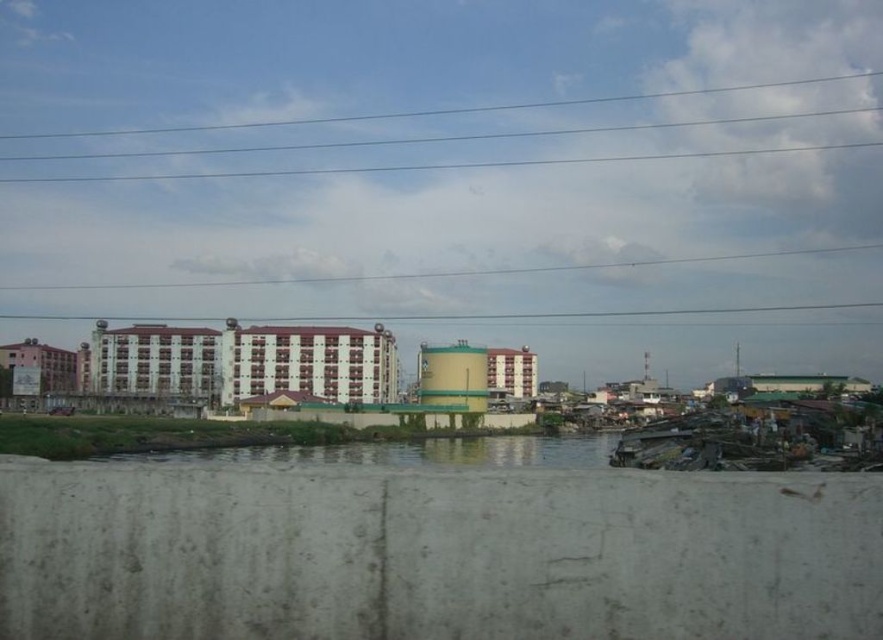
You are an urban planner analyzing the layout of this area. Given the white concrete building at center and the clear blue wires at upper center, which one has a smaller width?

The white concrete building at center has a smaller width than the clear blue wires at upper center.

You are standing at the origin point in the image and want to reach the point at the back. Which coordinate should you head towards, point (331,339) or point (261,452)?

Point (331,339) is behind point (261,452), so you should head towards point (331,339) to reach the point at the back.